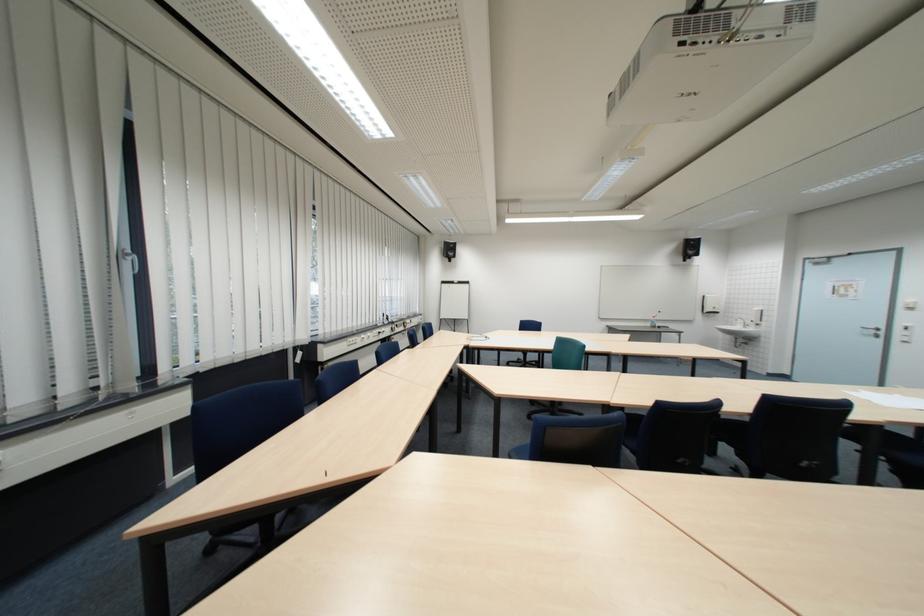
The image size is (924, 616). I want to click on wall soap dispenser, so click(x=757, y=315).